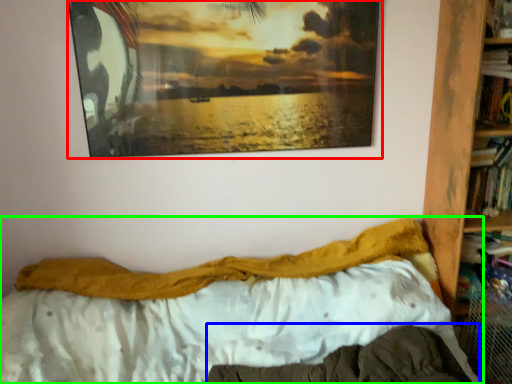
Question: Considering the real-world distances, which object is closest to picture frame (highlighted by a red box)? mattress (highlighted by a blue box) or bed (highlighted by a green box).

Choices:
 (A) mattress
 (B) bed

Answer: (B)